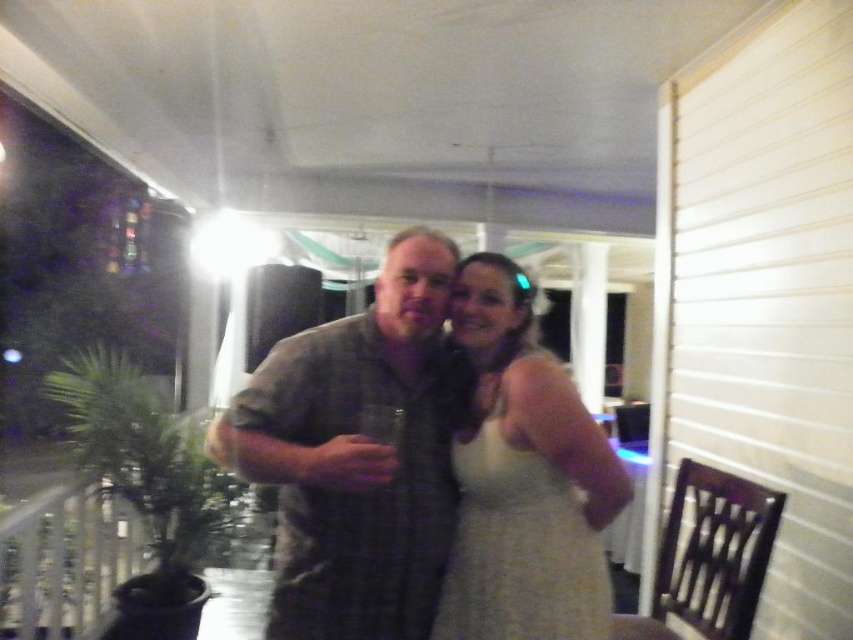
Is point (395, 317) positioned before point (602, 572)?

No, it is not.

Who is taller, gray plaid shirt at center or white satin dress at center?

gray plaid shirt at center is taller.

Does point (343, 518) come in front of point (486, 468)?

That is True.

Locate an element on the screen. The image size is (853, 640). gray plaid shirt at center is located at coordinates (355, 456).